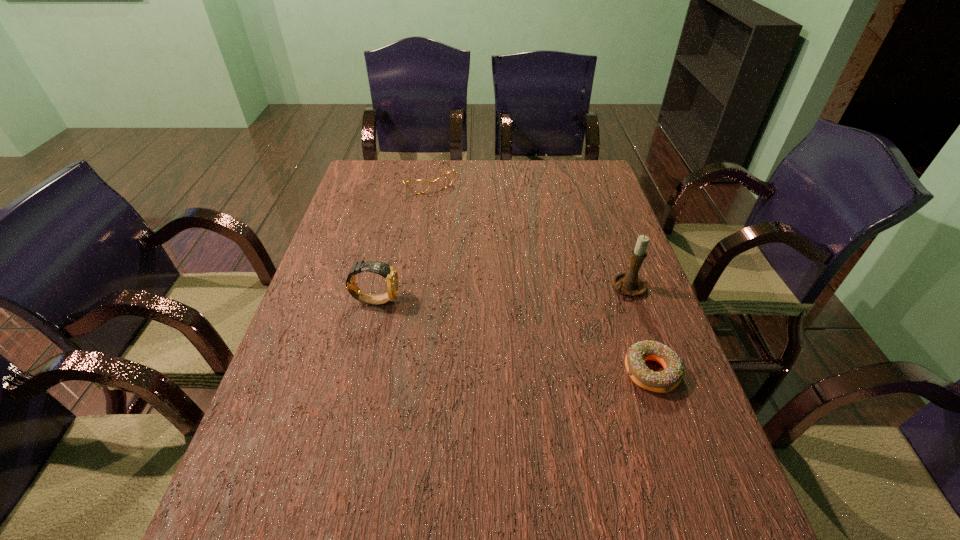
Locate an element on the screen. free space that is in between the farthest object and the tallest object is located at coordinates (526, 234).

The image size is (960, 540). What are the coordinates of `vacant space that is in between the watch and the shortest object` in the screenshot? It's located at (514, 336).

Image resolution: width=960 pixels, height=540 pixels. Find the location of `vacant area that lies between the nearest object and the tallest object`. vacant area that lies between the nearest object and the tallest object is located at coordinates (639, 329).

The image size is (960, 540). Find the location of `unoccupied position between the candle holder and the third tallest object`. unoccupied position between the candle holder and the third tallest object is located at coordinates (526, 234).

The height and width of the screenshot is (540, 960). I want to click on empty location between the watch and the third tallest object, so click(x=400, y=240).

Locate which object ranks second in proximity to the nearest object. Please provide its 2D coordinates. Your answer should be formatted as a tuple, i.e. [(x, y)], where the tuple contains the x and y coordinates of a point satisfying the conditions above.

[(388, 272)]

You are a GUI agent. You are given a task and a screenshot of the screen. Output one action in this format:
    pyautogui.click(x=<x>, y=<y>)
    Task: Click on the object that can be found as the closest to the spectacles
    The image size is (960, 540).
    Given the screenshot: What is the action you would take?
    pyautogui.click(x=388, y=272)

Where is `free spot that satisfies the following two spatial constraints: 1. on the front side of the farthest object; 2. on the left side of the candle holder`? The height and width of the screenshot is (540, 960). free spot that satisfies the following two spatial constraints: 1. on the front side of the farthest object; 2. on the left side of the candle holder is located at coordinates (408, 287).